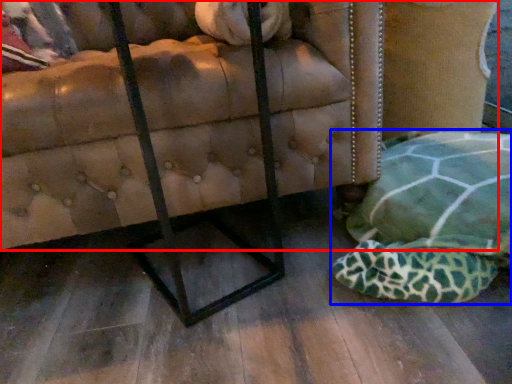
Question: Which of the following is the closest to the observer, furniture (highlighted by a red box) or swivel chair (highlighted by a blue box)?

Choices:
 (A) furniture
 (B) swivel chair

Answer: (B)